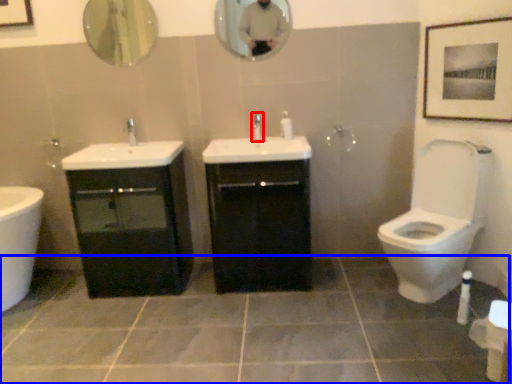
Question: Which object appears farthest to the camera in this image, tap (highlighted by a red box) or ceramic tile (highlighted by a blue box)?

Choices:
 (A) tap
 (B) ceramic tile

Answer: (A)